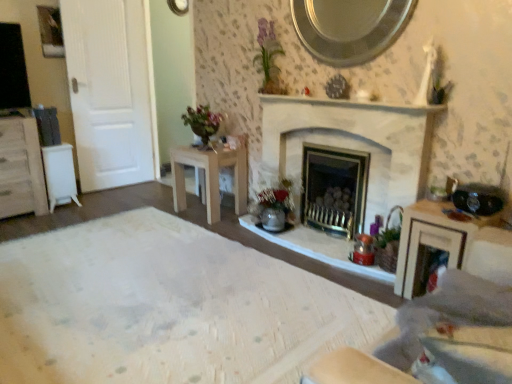
Find the location of a particular element. free space underneath silver metallic mirror at upper center (from a real-world perspective) is located at coordinates (345, 92).